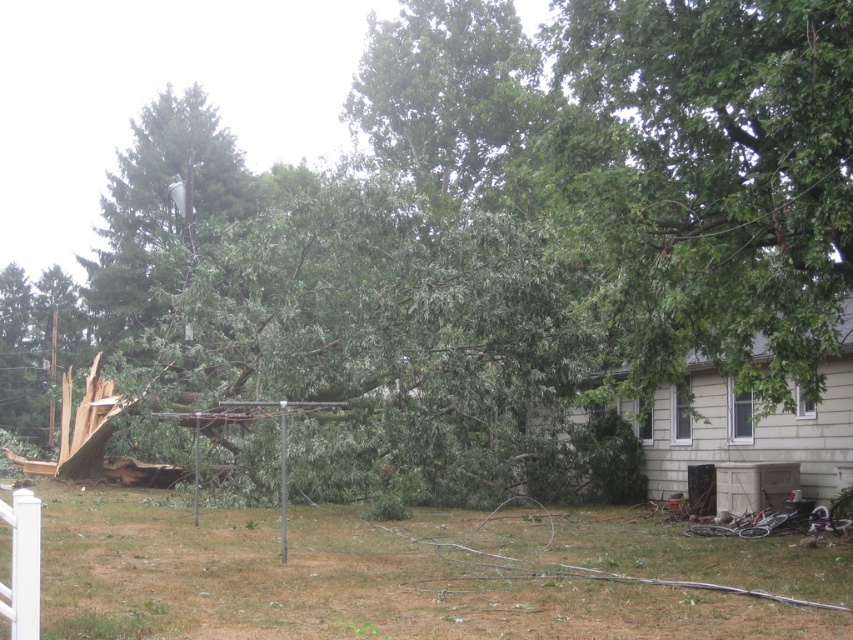
Question: Is brown wood debris at lower center positioned in front of green leafy tree at upper left?

Choices:
 (A) no
 (B) yes

Answer: (B)

Question: In this image, where is brown wood debris at lower center located relative to green leafy tree at upper right?

Choices:
 (A) right
 (B) left

Answer: (B)

Question: Which point is farther to the camera?

Choices:
 (A) (660, 186)
 (B) (515, 588)

Answer: (A)

Question: Which object is positioned farthest from the brown wood debris at lower center?

Choices:
 (A) green leafy tree at upper left
 (B) green leafy tree at upper right

Answer: (A)

Question: Is brown wood debris at lower center further to the viewer compared to green leafy tree at upper left?

Choices:
 (A) yes
 (B) no

Answer: (B)

Question: Considering the real-world distances, which object is closest to the green leafy tree at upper right?

Choices:
 (A) green leafy tree at upper left
 (B) brown wood debris at lower center

Answer: (B)